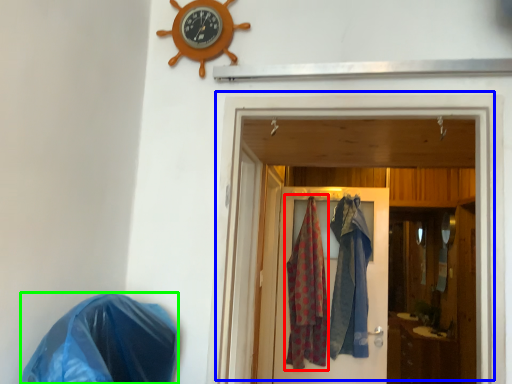
Question: Which is farther away from clothing (highlighted by a red box)? door (highlighted by a blue box) or material (highlighted by a green box)?

Choices:
 (A) door
 (B) material

Answer: (B)